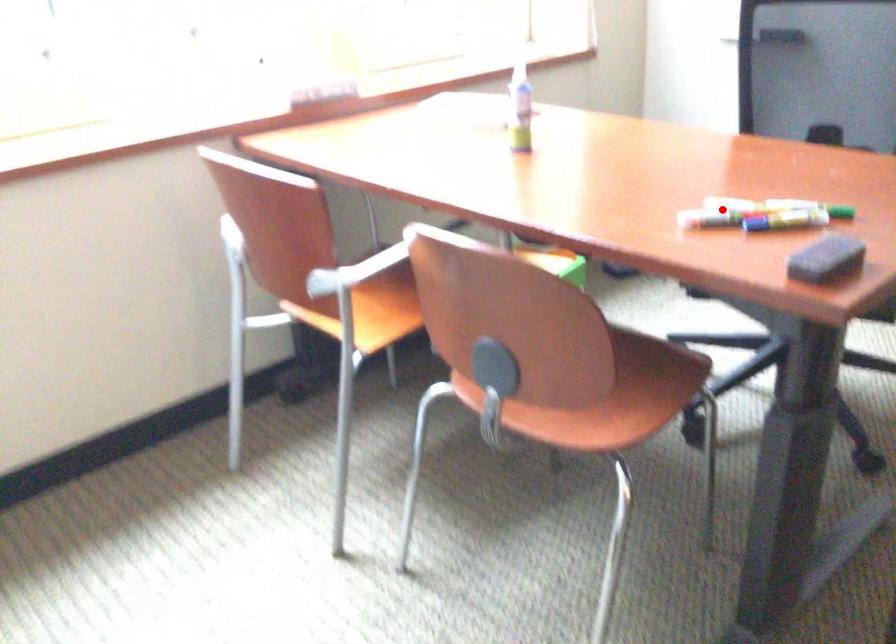
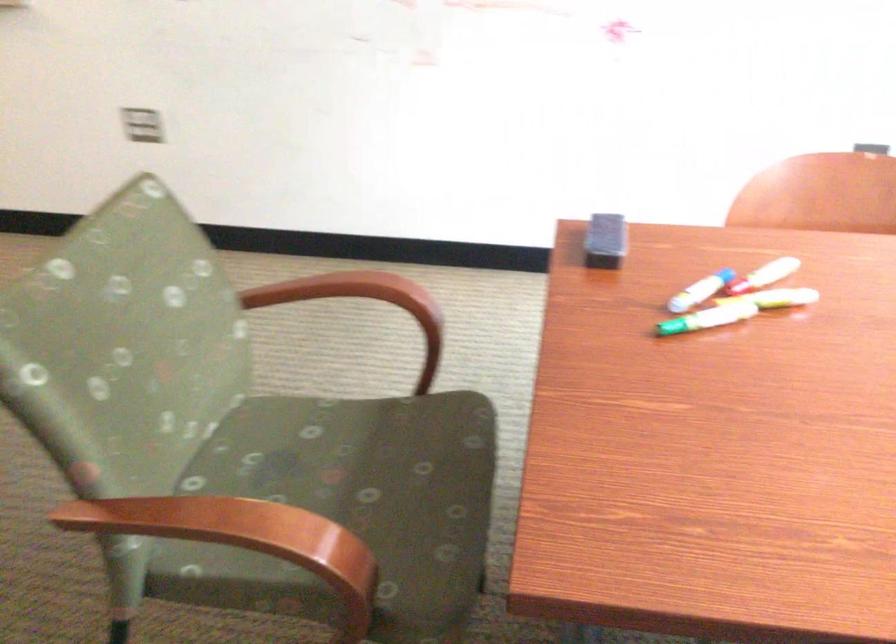
Question: I am providing you with two images of the same scene from different viewpoints. In image1, a red point is highlighted. Considering the same 3D point in image2, which of the following is correct?

Choices:
 (A) It is closer
 (B) It is farther

Answer: (A)